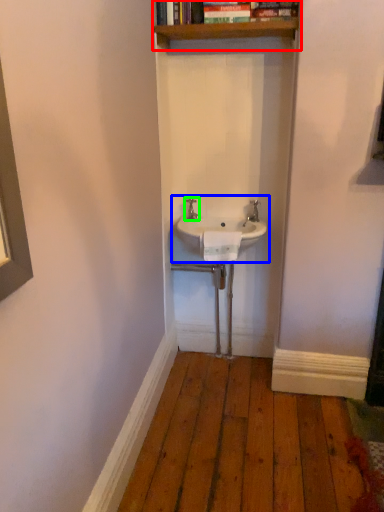
Question: Which object is the closest to the shelf (highlighted by a red box)? Choose among these: sink (highlighted by a blue box) or tap (highlighted by a green box).

Choices:
 (A) sink
 (B) tap

Answer: (B)